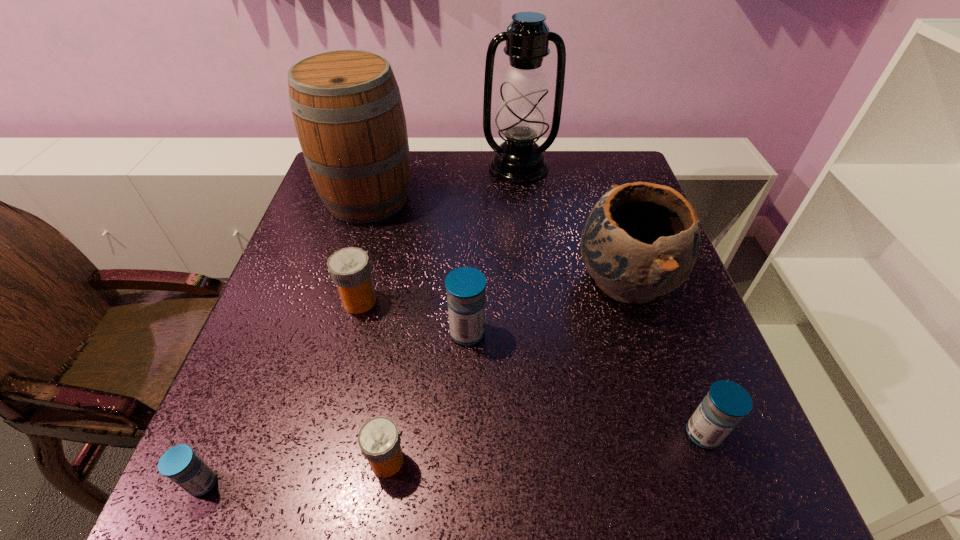
Where is `vacant area at the near edge`? This screenshot has height=540, width=960. vacant area at the near edge is located at coordinates (511, 491).

This screenshot has height=540, width=960. Find the location of `vacant space at the left edge of the desktop`. vacant space at the left edge of the desktop is located at coordinates (x=297, y=306).

Identify the location of free space at the right edge of the desktop. (660, 318).

At what (x,y) coordinates should I click in order to perform the action: click on blank area at the near right corner. Please return your answer as a coordinate pair (x, y). The width and height of the screenshot is (960, 540). Looking at the image, I should click on (675, 482).

The height and width of the screenshot is (540, 960). I want to click on free spot between the leftmost blue medicine and the black oil lamp, so click(x=361, y=326).

In order to click on empty location between the cider and the farthest blue medicine in this screenshot , I will do `click(418, 266)`.

The width and height of the screenshot is (960, 540). I want to click on blank region between the second blue medicine from right to left and the second farthest blue medicine, so click(585, 383).

Locate an element on the screen. The width and height of the screenshot is (960, 540). free space that is in between the leftmost medicine and the pottery is located at coordinates (414, 382).

Where is `vacant area that lies between the biggest blue medicine and the third tallest object`? vacant area that lies between the biggest blue medicine and the third tallest object is located at coordinates (546, 307).

This screenshot has height=540, width=960. I want to click on free point between the rightmost medicine and the sixth shortest object, so click(x=664, y=357).